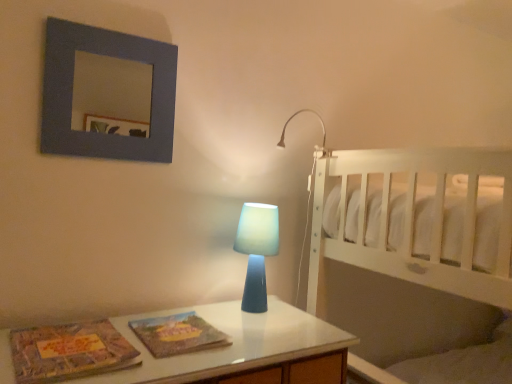
Question: Choose the correct answer: Is textured paper magazine at center, placed as the second magazine when sorted from left to right, inside blue translucent lamp at upper right, which is the first lamp from top to bottom, or outside it?

Choices:
 (A) outside
 (B) inside

Answer: (A)

Question: Is textured paper magazine at center, placed as the second magazine when sorted from left to right, in front of or behind blue translucent lamp at upper right, which is the first lamp from top to bottom, in the image?

Choices:
 (A) front
 (B) behind

Answer: (A)

Question: Which of these objects is positioned farthest from the textured paper magazine at center, which appears as the first magazine when viewed from the right?

Choices:
 (A) blue translucent lamp at center, marked as the 2th lamp in a top-to-bottom arrangement
 (B) matte gray picture frame at upper left
 (C) blue translucent lamp at upper right, acting as the 1th lamp starting from the right
 (D) matte cardboard magazine at lower left, which appears as the 1th magazine when viewed from the left
 (E) white wooden bed at right

Answer: (B)

Question: Which object is the farthest from the textured paper magazine at center, placed as the second magazine when sorted from left to right?

Choices:
 (A) matte gray picture frame at upper left
 (B) blue translucent lamp at upper right, which is the first lamp from top to bottom
 (C) white wooden bed at right
 (D) blue translucent lamp at center, marked as the 2th lamp in a top-to-bottom arrangement
 (E) matte cardboard magazine at lower left, which is the second magazine from right to left

Answer: (A)